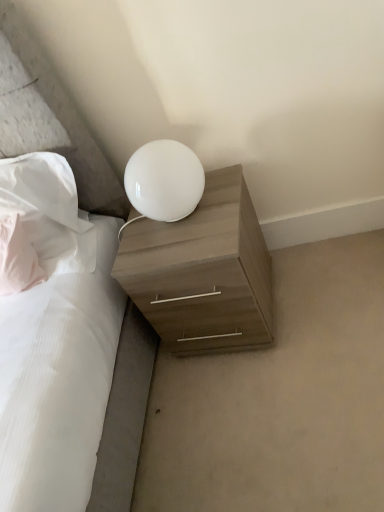
The height and width of the screenshot is (512, 384). Identify the location of free location to the right of white glossy lamp at upper center. (223, 191).